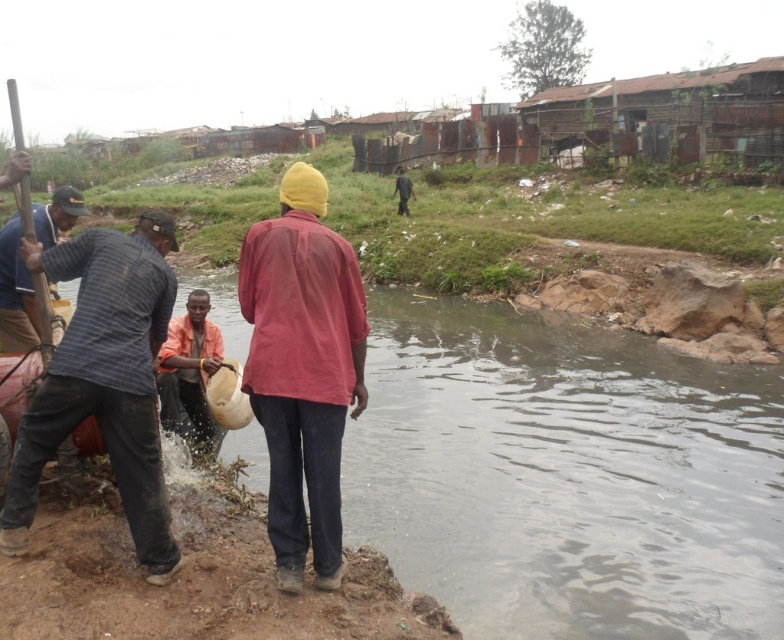
The width and height of the screenshot is (784, 640). I want to click on striped cotton shirt at left, so click(104, 380).

Is striped cotton shirt at left shorter than orange fabric bag at lower left?

No, striped cotton shirt at left is not shorter than orange fabric bag at lower left.

Is point (64, 396) farther from viewer compared to point (165, 378)?

No, (64, 396) is closer to viewer.

At what (x,y) coordinates should I click in order to perform the action: click on striped cotton shirt at left. Please return your answer as a coordinate pair (x, y). Image resolution: width=784 pixels, height=640 pixels. Looking at the image, I should click on (104, 380).

Can you confirm if matte red shirt at center is smaller than striped fabric shirt at left?

Yes, matte red shirt at center is smaller than striped fabric shirt at left.

Does matte red shirt at center have a greater width compared to striped fabric shirt at left?

No, matte red shirt at center is not wider than striped fabric shirt at left.

Find the location of a particular element. matte red shirt at center is located at coordinates (302, 369).

Locate an element on the screen. matte red shirt at center is located at coordinates (302, 369).

Is clear water at river right below striped fabric shirt at left?

Correct, clear water at river right is located below striped fabric shirt at left.

Does point (516, 616) come closer to viewer compared to point (46, 216)?

That is True.

You are a GUI agent. You are given a task and a screenshot of the screen. Output one action in this format:
    pyautogui.click(x=<x>, y=<y>)
    Task: Click on the clear water at river right
    Image resolution: width=784 pixels, height=640 pixels.
    Given the screenshot: What is the action you would take?
    pyautogui.click(x=565, y=476)